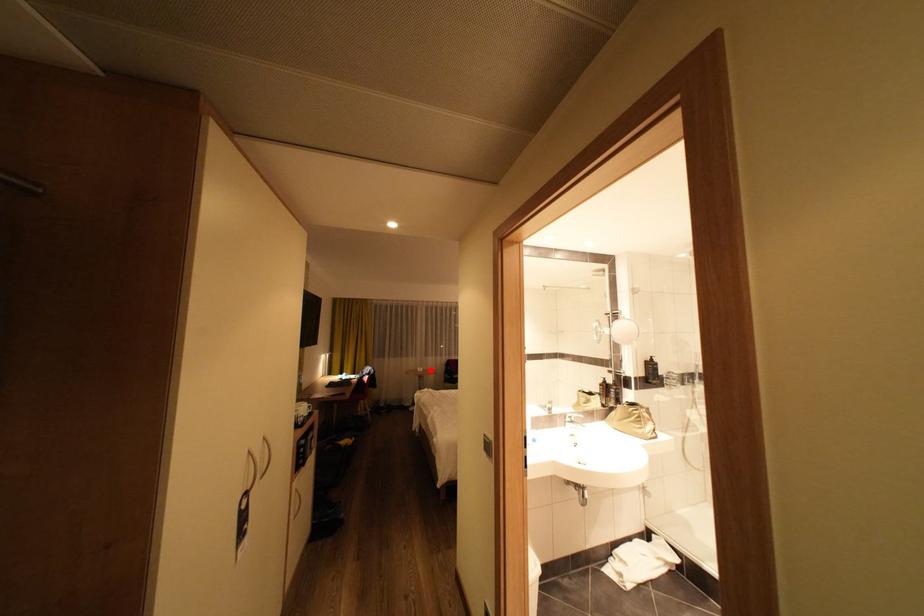
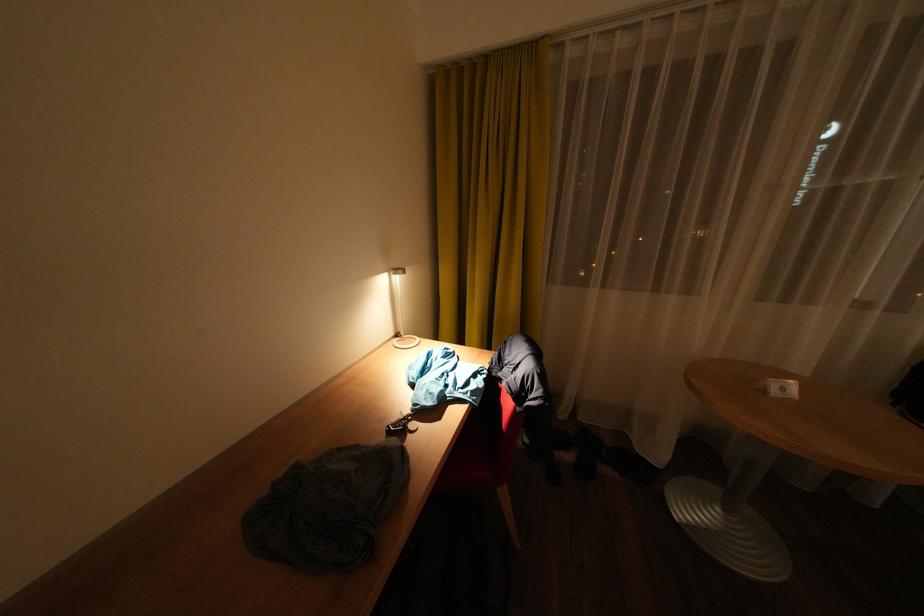
Question: I am providing you with two images of the same scene from different viewpoints. Given a red point in image1, look at the same physical point in image2. Is it:

Choices:
 (A) Closer to the viewpoint
 (B) Farther from the viewpoint

Answer: (A)